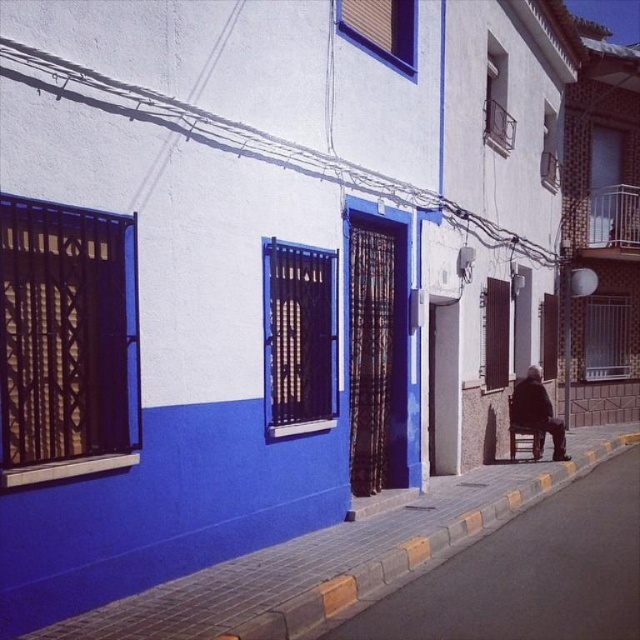
You are standing on the street in the image and want to walk to the smooth concrete pavement at lower center. Which direction should you go from your current position at point (529, 572)?

The point (529, 572) is already at the smooth concrete pavement at lower center, so you are already there.